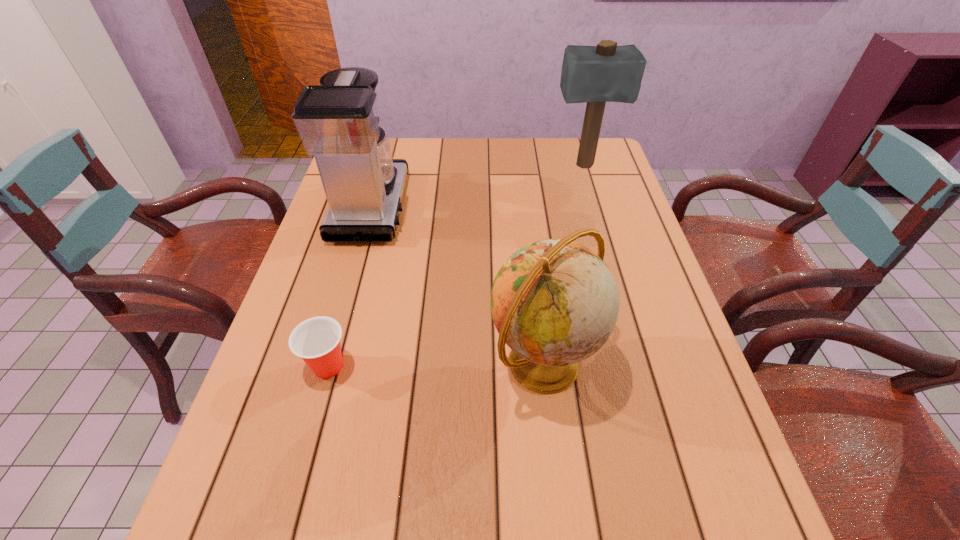
Where is `free space between the globe and the coffee maker`? free space between the globe and the coffee maker is located at coordinates (457, 286).

The height and width of the screenshot is (540, 960). What are the coordinates of `empty space that is in between the globe and the cup` in the screenshot? It's located at (435, 366).

Locate an element on the screen. free area in between the coffee maker and the mallet is located at coordinates (477, 186).

At what (x,y) coordinates should I click in order to perform the action: click on vacant area that lies between the globe and the shortest object. Please return your answer as a coordinate pair (x, y). The height and width of the screenshot is (540, 960). Looking at the image, I should click on (435, 366).

The image size is (960, 540). Find the location of `vacant space that is in between the cup and the coffee maker`. vacant space that is in between the cup and the coffee maker is located at coordinates (349, 287).

Locate an element on the screen. Image resolution: width=960 pixels, height=540 pixels. vacant space that is in between the globe and the coffee maker is located at coordinates (457, 286).

The image size is (960, 540). Identify the location of free space that is in between the globe and the cup. (435, 366).

Identify the location of object that is the second closest to the cup. This screenshot has width=960, height=540. (338, 123).

Identify which object is the third closest to the shortest object. Please provide its 2D coordinates. Your answer should be formatted as a tuple, i.e. [(x, y)], where the tuple contains the x and y coordinates of a point satisfying the conditions above.

[(604, 73)]

Locate an element on the screen. The image size is (960, 540). vacant position in the image that satisfies the following two spatial constraints: 1. at the front of the coffee maker where the controls are located; 2. on the right side of the shortest object is located at coordinates (326, 366).